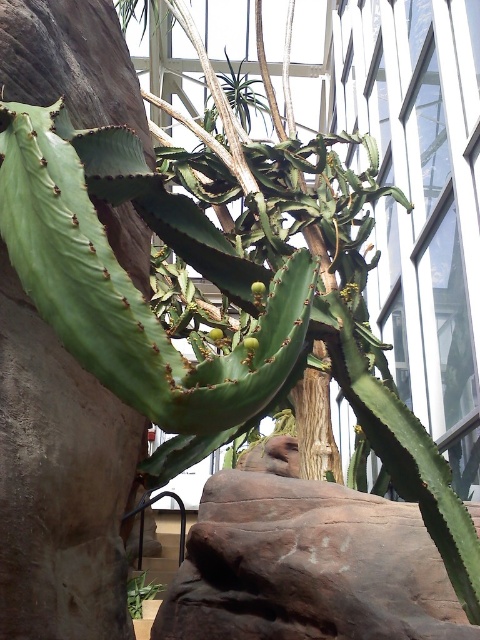
Identify the location of brown rough rock at center. (307, 566).

Between brown rough rock at center and green matte plant at lower left, which one is positioned lower?

green matte plant at lower left

Between point (255, 532) and point (133, 614), which one is positioned in front?

Point (255, 532) is in front.

Where is `brown rough rock at center`? The image size is (480, 640). brown rough rock at center is located at coordinates (307, 566).

Does brown rough rock at center have a smaller size compared to green succulent at center?

No, brown rough rock at center is not smaller than green succulent at center.

Is brown rough rock at center behind green succulent at center?

No, it is not.

Describe the element at coordinates (307, 566) in the screenshot. I see `brown rough rock at center` at that location.

Find the location of a particular element. This screenshot has width=480, height=640. brown rough rock at center is located at coordinates (307, 566).

From the picture: Is green succulent at center shorter than green matte plant at lower left?

No.

Locate an element on the screen. The height and width of the screenshot is (640, 480). green succulent at center is located at coordinates (242, 96).

Who is more forward, (264,106) or (135,604)?

Point (135,604) is in front.

Where is `green succulent at center`? The width and height of the screenshot is (480, 640). green succulent at center is located at coordinates (242, 96).